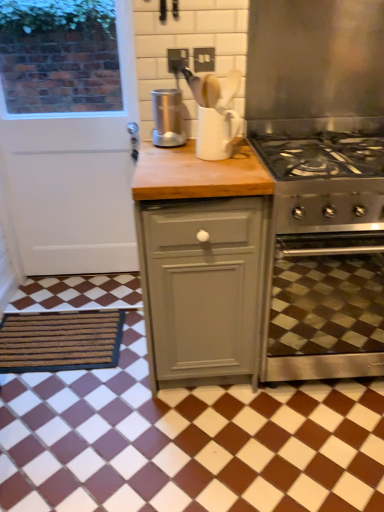
Find the location of a particular element. blank space to the left of white glossy mug at upper center is located at coordinates (167, 154).